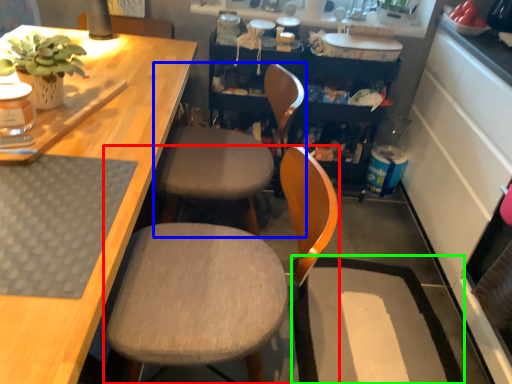
Question: Which is farther away from chair (highlighted by a red box)? chair (highlighted by a blue box) or wide (highlighted by a green box)?

Choices:
 (A) chair
 (B) wide

Answer: (B)